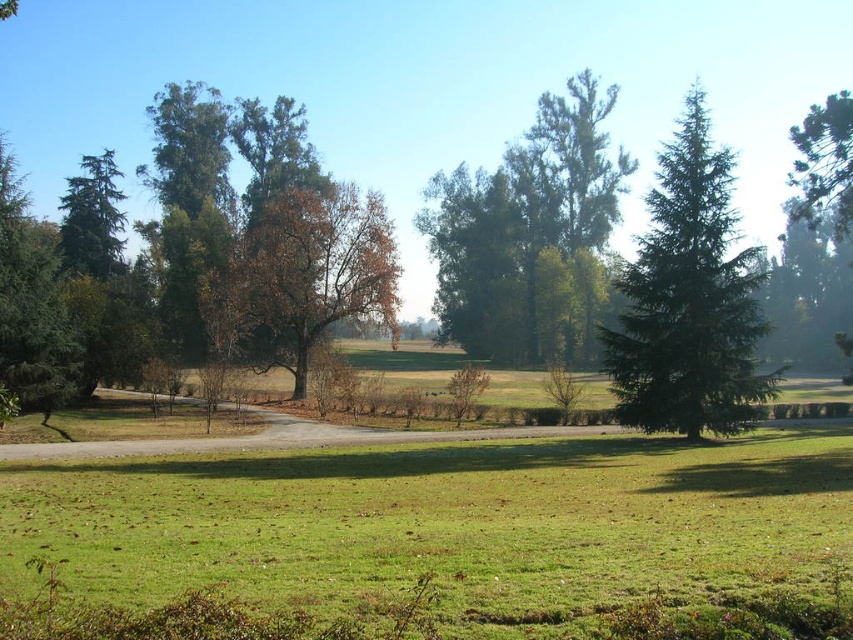
The image size is (853, 640). What do you see at coordinates (444, 524) in the screenshot?
I see `green grass at center` at bounding box center [444, 524].

Can you confirm if green grass at center is bigger than green needle-like tree at left?

Incorrect, green grass at center is not larger than green needle-like tree at left.

Between point (263, 556) and point (55, 288), which one is positioned in front?

Positioned in front is point (263, 556).

Find the location of a particular element. green grass at center is located at coordinates (444, 524).

Does point (281, 365) lie in front of point (15, 324)?

No, it is behind (15, 324).

From the picture: Does brown leafy tree at center have a greater width compared to green needle-like tree at left?

No.

Between point (282, 342) and point (56, 392), which one is positioned in front?

Point (56, 392)

Find the location of `brown leafy tree at center`. brown leafy tree at center is located at coordinates (300, 278).

Does green grass at center have a larger size compared to green needle-like tree at right?

Incorrect, green grass at center is not larger than green needle-like tree at right.

The image size is (853, 640). I want to click on green grass at center, so click(x=444, y=524).